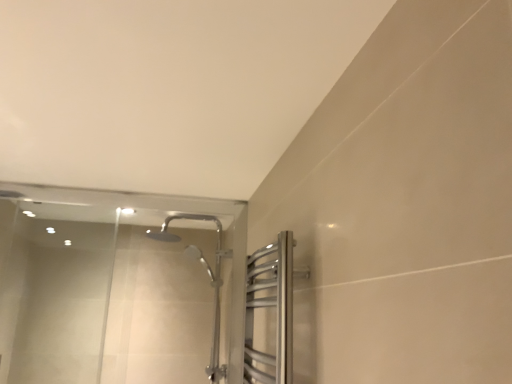
Question: Is satin nickel towel rack at upper right in front of or behind transparent glass shower door at upper left in the image?

Choices:
 (A) behind
 (B) front

Answer: (B)

Question: Does point (259, 350) appear closer or farther from the camera than point (129, 198)?

Choices:
 (A) closer
 (B) farther

Answer: (A)

Question: From the image's perspective, is satin nickel towel rack at upper right positioned above or below transparent glass shower door at upper left?

Choices:
 (A) below
 (B) above

Answer: (B)

Question: In terms of size, does transparent glass shower door at upper left appear bigger or smaller than satin nickel towel rack at upper right?

Choices:
 (A) small
 (B) big

Answer: (B)

Question: Is transparent glass shower door at upper left taller or shorter than satin nickel towel rack at upper right?

Choices:
 (A) tall
 (B) short

Answer: (A)

Question: From the image's perspective, relative to satin nickel towel rack at upper right, is transparent glass shower door at upper left above or below?

Choices:
 (A) below
 (B) above

Answer: (A)

Question: Considering their positions, is transparent glass shower door at upper left located in front of or behind satin nickel towel rack at upper right?

Choices:
 (A) front
 (B) behind

Answer: (B)